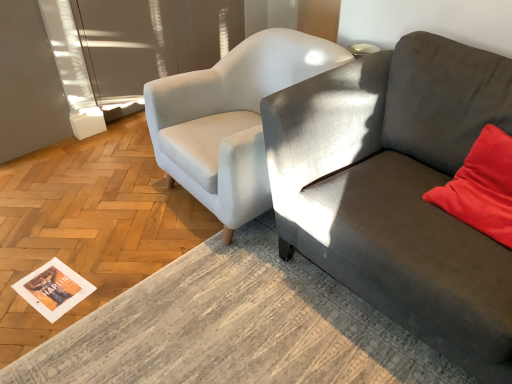
Question: Could you tell me if white paper magazine at lower left is facing transparent glass door at upper left?

Choices:
 (A) no
 (B) yes

Answer: (A)

Question: Is white paper magazine at lower left wider than transparent glass door at upper left?

Choices:
 (A) no
 (B) yes

Answer: (B)

Question: Is the position of white paper magazine at lower left more distant than that of transparent glass door at upper left?

Choices:
 (A) yes
 (B) no

Answer: (B)

Question: Can you confirm if white paper magazine at lower left is thinner than transparent glass door at upper left?

Choices:
 (A) yes
 (B) no

Answer: (B)

Question: Considering the relative positions of white paper magazine at lower left and transparent glass door at upper left in the image provided, is white paper magazine at lower left to the right of transparent glass door at upper left from the viewer's perspective?

Choices:
 (A) yes
 (B) no

Answer: (B)

Question: Considering the relative sizes of white paper magazine at lower left and transparent glass door at upper left in the image provided, is white paper magazine at lower left shorter than transparent glass door at upper left?

Choices:
 (A) yes
 (B) no

Answer: (A)

Question: Is velvet red pillow at right shorter than white fabric chair at center?

Choices:
 (A) no
 (B) yes

Answer: (B)

Question: Can you confirm if velvet red pillow at right is bigger than white fabric chair at center?

Choices:
 (A) no
 (B) yes

Answer: (A)

Question: Is velvet red pillow at right aimed at white fabric chair at center?

Choices:
 (A) no
 (B) yes

Answer: (A)

Question: Is velvet red pillow at right outside of white fabric chair at center?

Choices:
 (A) no
 (B) yes

Answer: (B)

Question: Does velvet red pillow at right appear on the left side of white fabric chair at center?

Choices:
 (A) yes
 (B) no

Answer: (B)

Question: Considering the relative sizes of velvet red pillow at right and white fabric chair at center in the image provided, is velvet red pillow at right taller than white fabric chair at center?

Choices:
 (A) no
 (B) yes

Answer: (A)

Question: Can you confirm if white fabric chair at center is positioned to the right of transparent glass door at upper left?

Choices:
 (A) no
 (B) yes

Answer: (B)